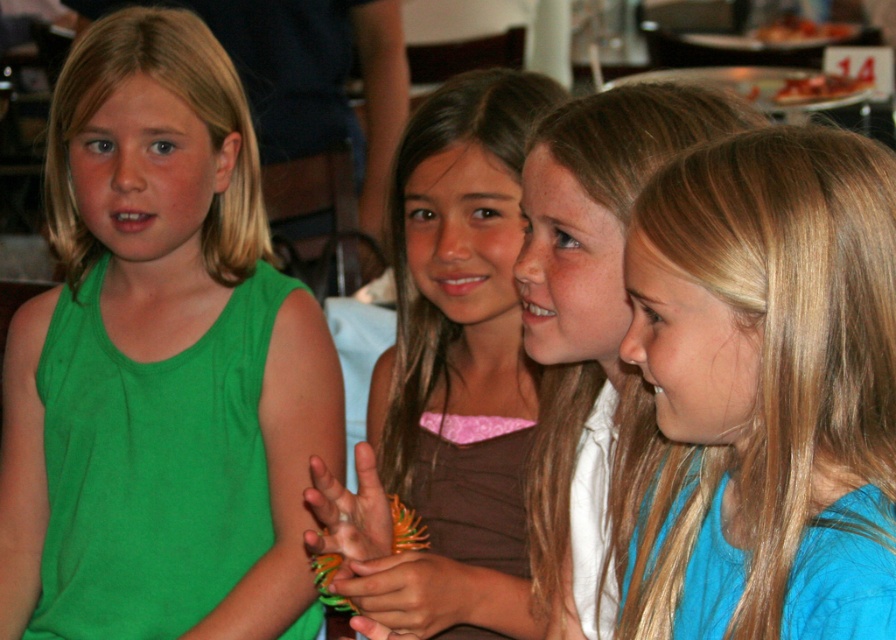
You are a photographer trying to capture the group of four girls in the image. You want to ensure that the point at coordinate point (x=409, y=589) is visible in your shot. Based on the scene description, can you confirm if this point is on an object that is part of the group of girls?

Yes, the point at coordinate point (x=409, y=589) is on a smooth orange bracelet at center, which is part of the group of girls.

In the scene with four girls, there is a point marked at coordinates (767, 388). Which girl is this point indicating?

The point at (767, 388) marks the blue smooth shirt at right.